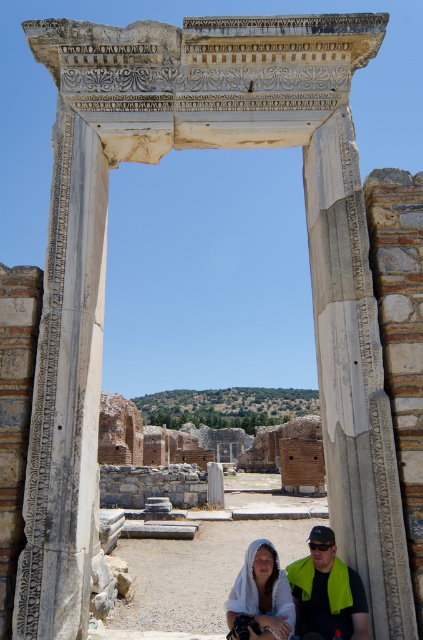
The width and height of the screenshot is (423, 640). Identify the location of green fabric towel at lower center. (327, 596).

This screenshot has width=423, height=640. What do you see at coordinates (327, 596) in the screenshot?
I see `green fabric towel at lower center` at bounding box center [327, 596].

The width and height of the screenshot is (423, 640). Find the location of `green fabric towel at lower center`. green fabric towel at lower center is located at coordinates (327, 596).

Who is more forward, (345, 589) or (288, 637)?

Point (288, 637)

Locate an element on the screen. Image resolution: width=423 pixels, height=640 pixels. green fabric towel at lower center is located at coordinates (327, 596).

I want to click on green fabric towel at lower center, so click(x=327, y=596).

Is white cloth at center to the left of black plastic goggles at lower center from the viewer's perspective?

Yes, white cloth at center is to the left of black plastic goggles at lower center.

Between point (241, 573) and point (321, 547), which one is positioned in front?

Point (321, 547) is in front.

Locate an element on the screen. The width and height of the screenshot is (423, 640). white cloth at center is located at coordinates (260, 596).